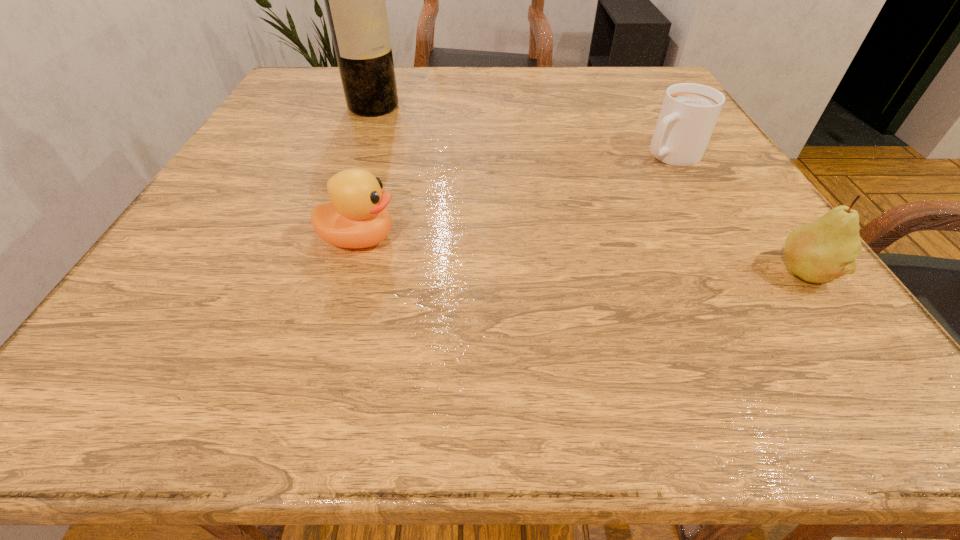
Where is `duckling`? This screenshot has width=960, height=540. duckling is located at coordinates (357, 217).

At what (x,y) coordinates should I click in order to perform the action: click on pear. Please return your answer as a coordinate pair (x, y). Looking at the image, I should click on (822, 251).

This screenshot has width=960, height=540. What are the coordinates of `cappuccino` in the screenshot? It's located at (689, 112).

Locate an element on the screen. The height and width of the screenshot is (540, 960). liquor is located at coordinates pyautogui.click(x=355, y=3).

You are a GUI agent. You are given a task and a screenshot of the screen. Output one action in this format:
    pyautogui.click(x=<x>, y=<y>)
    Task: Click on the farthest object
    
    Given the screenshot: What is the action you would take?
    pyautogui.click(x=355, y=3)

The width and height of the screenshot is (960, 540). Identify the location of free location located on the face of the duckling. (586, 239).

Where is `free spot located 0.400m on the back of the pear`? The width and height of the screenshot is (960, 540). free spot located 0.400m on the back of the pear is located at coordinates (700, 129).

Identify the location of blank space located 0.180m on the side with the handle of the cappuccino. Image resolution: width=960 pixels, height=540 pixels. (594, 204).

Identify the location of free space located on the side with the handle of the cappuccino. The height and width of the screenshot is (540, 960). pyautogui.click(x=612, y=193).

The image size is (960, 540). I want to click on free space located on the side with the handle of the cappuccino, so click(x=514, y=256).